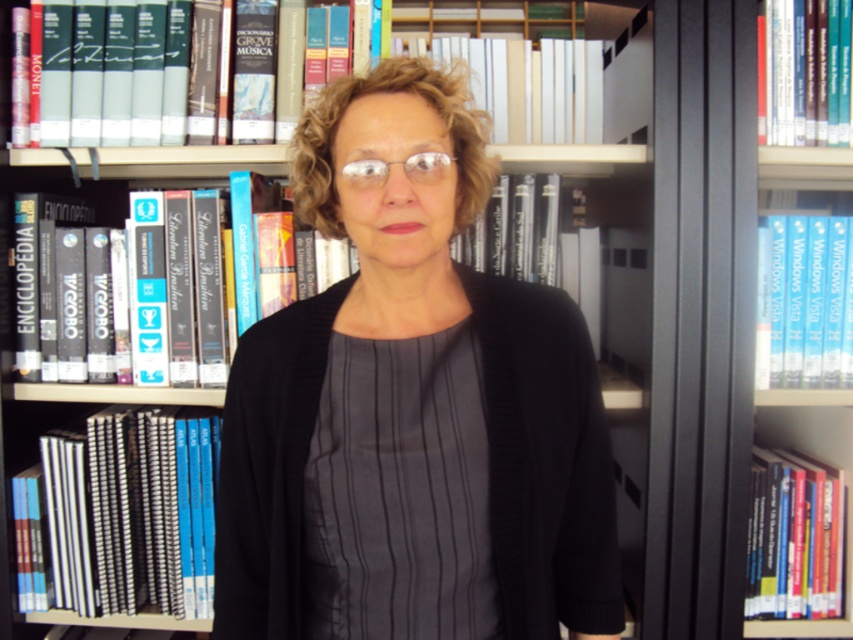
Which of these two, blue hardcover book at right or hardcover book at upper right, stands taller?

With more height is blue hardcover book at right.

Between blue hardcover book at right and hardcover book at upper right, which one is positioned lower?

Positioned lower is blue hardcover book at right.

Between point (834, 300) and point (817, 112), which one is positioned behind?

Point (834, 300)

Where is `blue hardcover book at right`? This screenshot has height=640, width=853. blue hardcover book at right is located at coordinates (809, 300).

Which is behind, point (62, 108) or point (57, 214)?

Positioned behind is point (57, 214).

Which of these two, hardcover book at upper left or hardcover book at center, stands taller?

hardcover book at center

Where is `hardcover book at upper left`? hardcover book at upper left is located at coordinates (112, 74).

The width and height of the screenshot is (853, 640). In order to click on hardcover book at upper left in this screenshot , I will do `click(112, 74)`.

Is point (820, 243) less distant than point (434, 157)?

No, it is behind (434, 157).

Between blue hardcover book at right and clear plastic glasses at center, which one appears on the left side from the viewer's perspective?

clear plastic glasses at center

Who is more distant from viewer, (x=788, y=292) or (x=364, y=166)?

Positioned behind is point (x=788, y=292).

Find the location of a particular element. blue hardcover book at right is located at coordinates (809, 300).